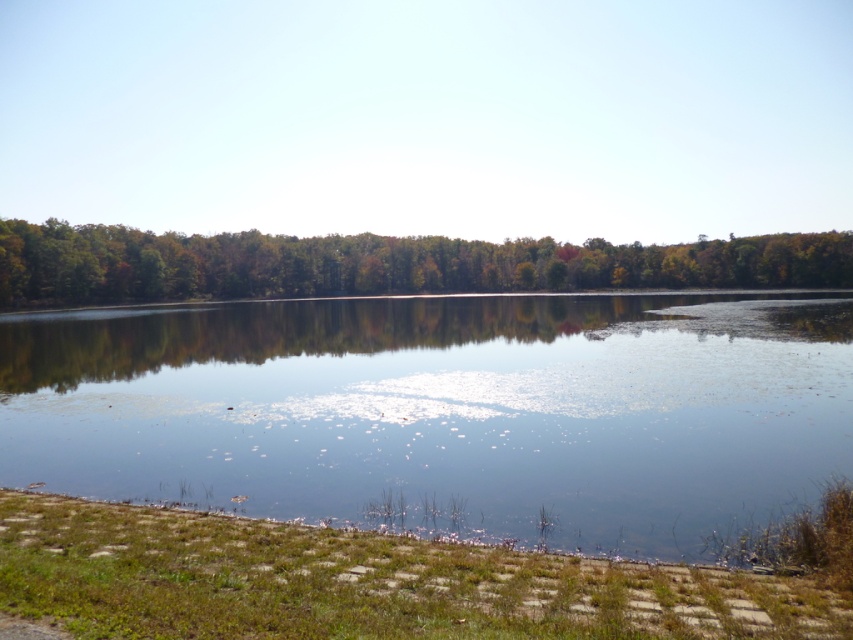
Can you confirm if clear water at center is thinner than green matte trees at upper center?

Indeed, clear water at center has a lesser width compared to green matte trees at upper center.

Does clear water at center appear on the right side of green matte trees at upper center?

Incorrect, clear water at center is not on the right side of green matte trees at upper center.

Is point (635, 296) less distant than point (619, 244)?

Yes.

Where is `clear water at center`? This screenshot has height=640, width=853. clear water at center is located at coordinates (444, 408).